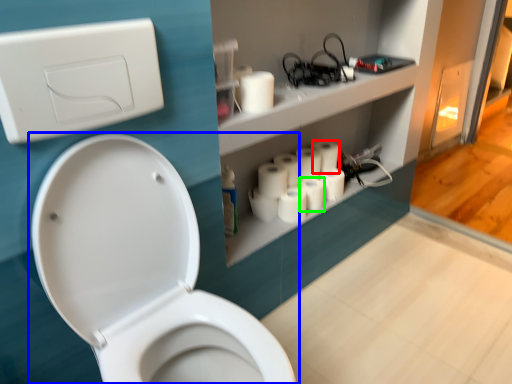
Question: Based on their relative distances, which object is farther from toilet paper (highlighted by a red box)? Choose from toilet (highlighted by a blue box) and toilet paper (highlighted by a green box).

Choices:
 (A) toilet
 (B) toilet paper

Answer: (A)